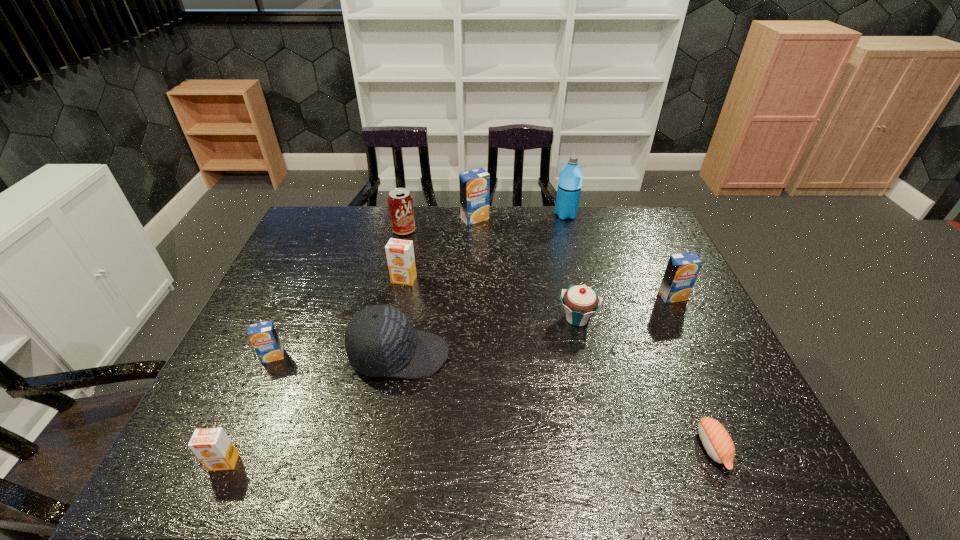
Locate an element on the screen. The height and width of the screenshot is (540, 960). sushi positioned at the near edge is located at coordinates (717, 442).

This screenshot has width=960, height=540. Find the location of `orange_juice that is at the right edge`. orange_juice that is at the right edge is located at coordinates (682, 270).

At what (x,y) coordinates should I click in order to perform the action: click on sushi that is positioned at the right edge. Please return your answer as a coordinate pair (x, y). Looking at the image, I should click on (717, 442).

Image resolution: width=960 pixels, height=540 pixels. Identify the location of object that is at the near left corner. (212, 446).

You are a GUI agent. You are given a task and a screenshot of the screen. Output one action in this format:
    pyautogui.click(x=<x>, y=<y>)
    Task: Click on the object that is at the near right corner
    The height and width of the screenshot is (540, 960).
    Given the screenshot: What is the action you would take?
    click(x=717, y=442)

Locate an element on the screen. This screenshot has height=540, width=960. free region at the far edge of the desktop is located at coordinates (450, 234).

The height and width of the screenshot is (540, 960). In the image, there is a desktop. In order to click on vacant space at the near edge in this screenshot , I will do `click(545, 454)`.

Where is `blank space at the left edge of the desktop`? The width and height of the screenshot is (960, 540). blank space at the left edge of the desktop is located at coordinates (287, 286).

The image size is (960, 540). In the image, there is a desktop. What are the coordinates of `vacant space at the near left corner` in the screenshot? It's located at coord(235,480).

This screenshot has width=960, height=540. What are the coordinates of `free space between the cupcake and the farthest orange juice` in the screenshot? It's located at (526, 268).